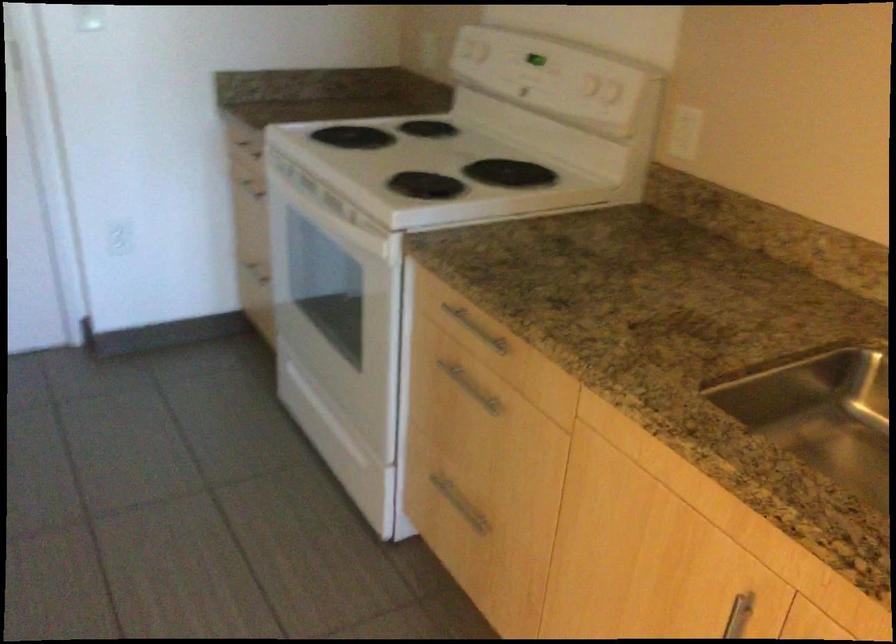
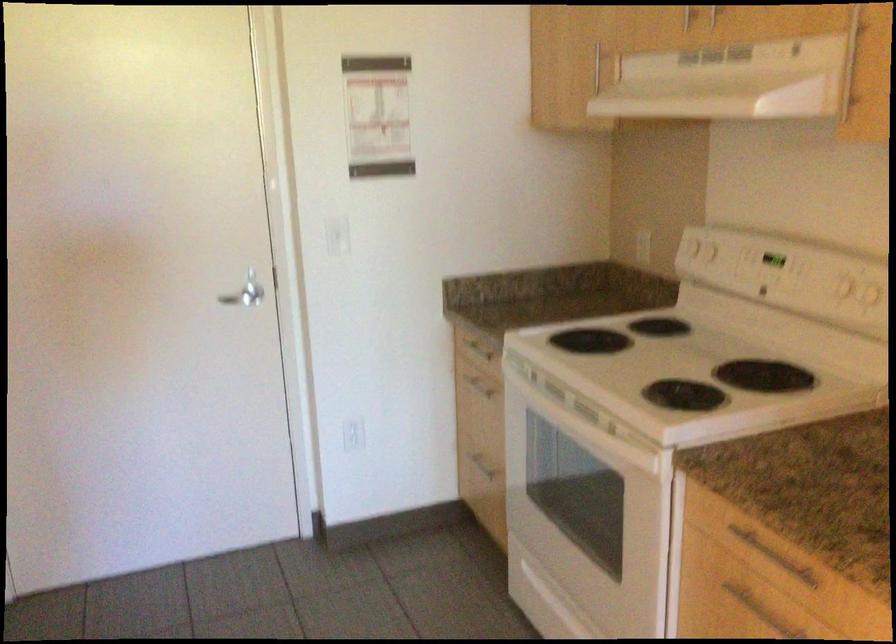
Locate, in the second image, the point that corresponds to point (119, 240) in the first image.

(352, 433)